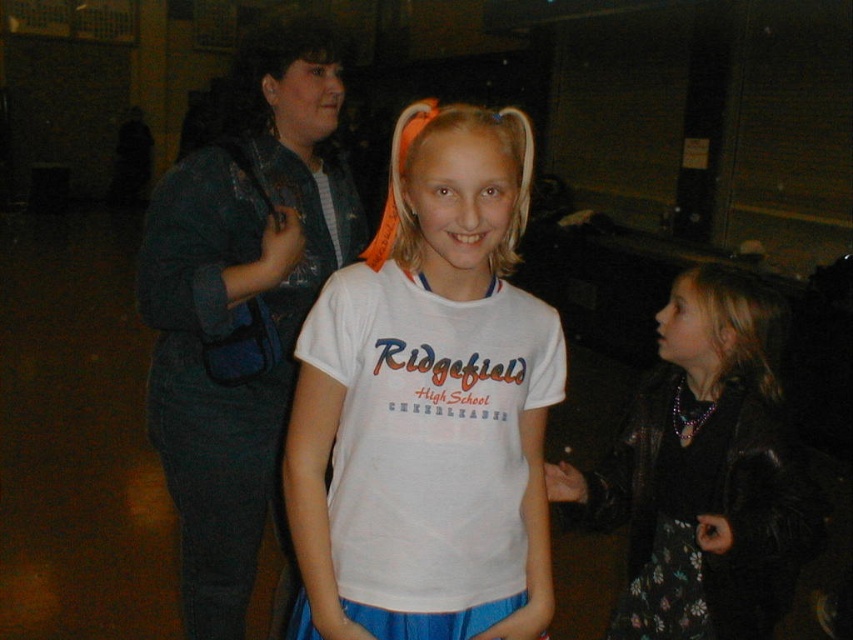
Does white cotton t-shirt at center have a larger size compared to shiny black hair at right?

Actually, white cotton t-shirt at center might be smaller than shiny black hair at right.

Can you confirm if white cotton t-shirt at center is positioned above shiny black hair at right?

Indeed, white cotton t-shirt at center is positioned over shiny black hair at right.

You are a GUI agent. You are given a task and a screenshot of the screen. Output one action in this format:
    pyautogui.click(x=<x>, y=<y>)
    Task: Click on the white cotton t-shirt at center
    
    Given the screenshot: What is the action you would take?
    (x=428, y=404)